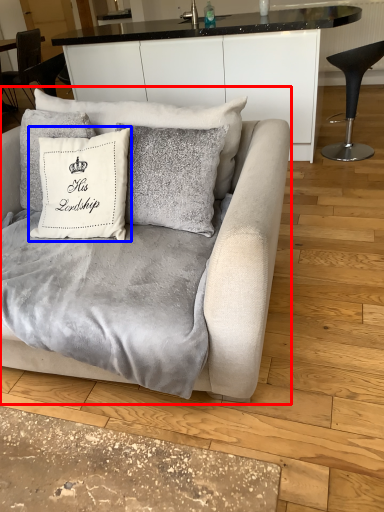
Question: Among these objects, which one is nearest to the camera, studio couch (highlighted by a red box) or pillow (highlighted by a blue box)?

Choices:
 (A) studio couch
 (B) pillow

Answer: (A)